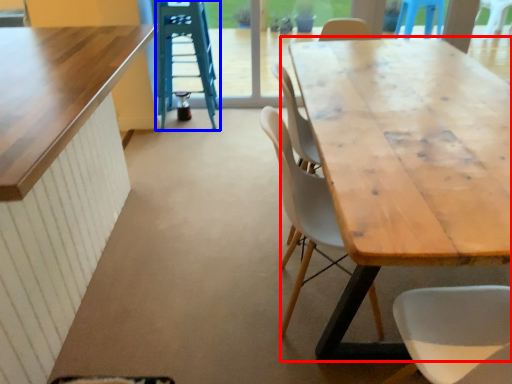
Question: Among these objects, which one is nearest to the camera, table (highlighted by a red box) or ladder (highlighted by a blue box)?

Choices:
 (A) table
 (B) ladder

Answer: (A)